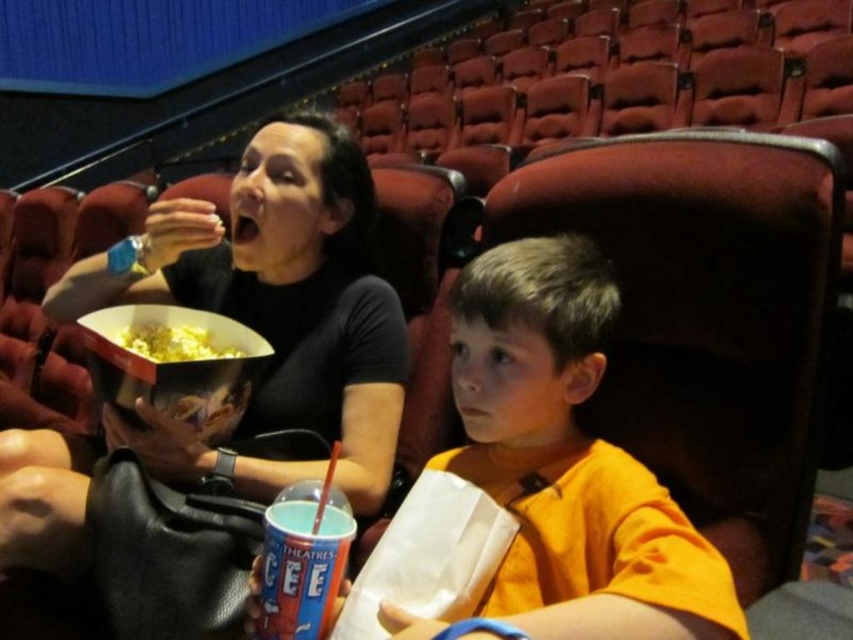
You are a moviegoer who just entered the theater and noticed the matte black popcorn bucket at center and the orange cotton shirt at center. Which object is larger in size?

The matte black popcorn bucket at center is bigger than the orange cotton shirt at center.

You are sitting in the movie theater and want to grab the blue plastic cup at lower center without touching the orange cotton shirt at center. Is this possible based on their positions?

The orange cotton shirt at center is above the blue plastic cup at lower center, so you can reach the blue plastic cup at lower center without touching the orange cotton shirt at center by moving your hand underneath.

You are a moviegoer sitting in the front row of this theater. You want to grab the matte black popcorn bucket at center and the blue plastic cup at lower center. Given that your arm can reach 16 inches, can you reach both items without moving your seat?

The distance between the matte black popcorn bucket at center and the blue plastic cup at lower center is 17.09 inches. Since your arm can only reach 16 inches, you cannot reach both items without moving your seat.